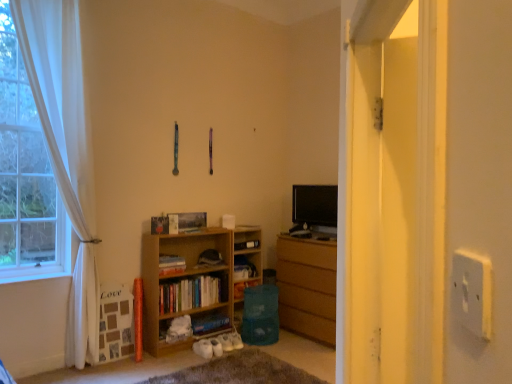
The image size is (512, 384). What do you see at coordinates (244, 287) in the screenshot? I see `wooden bookshelf at center` at bounding box center [244, 287].

Identify the location of wooden bookshelf at center. (244, 287).

Locate an element on the screen. This screenshot has height=384, width=512. light brown wood bookcase at lower left is located at coordinates (192, 281).

Describe the element at coordinates (307, 287) in the screenshot. I see `wooden chest of drawers at center` at that location.

Measure the distance between hardcover book at center, which appears as the first book when viewed from the top, and camera.

The depth of hardcover book at center, which appears as the first book when viewed from the top, is 3.81 meters.

At what (x,y) coordinates should I click in order to perform the action: click on hardcover book at center, which appears as the first book when viewed from the top. Please return your answer as a coordinate pair (x, y). Image resolution: width=512 pixels, height=384 pixels. Looking at the image, I should click on (170, 264).

Locate an element on the screen. wooden bookshelf at center, which is the 2th book from top to bottom is located at coordinates (190, 294).

Considering the sizes of objects hardcover book at center, which appears as the first book when viewed from the top, and light brown wood bookcase at lower left in the image provided, who is taller, hardcover book at center, which appears as the first book when viewed from the top, or light brown wood bookcase at lower left?

With more height is light brown wood bookcase at lower left.

Is hardcover book at center, which appears as the first book when viewed from the top, positioned before light brown wood bookcase at lower left?

No, hardcover book at center, which appears as the first book when viewed from the top, is behind light brown wood bookcase at lower left.

From a real-world perspective, who is located lower, hardcover book at center, which appears as the first book when viewed from the top, or light brown wood bookcase at lower left?

light brown wood bookcase at lower left, from a real-world perspective.

Considering the positions of point (184, 259) and point (156, 338), is point (184, 259) closer or farther from the camera than point (156, 338)?

Point (184, 259).

Are white sheer curtain at left and hardcover book at lower center, positioned as the 3th book in top-to-bottom order, beside each other?

No, white sheer curtain at left is not with hardcover book at lower center, positioned as the 3th book in top-to-bottom order.

Which object is positioned more to the right, white sheer curtain at left or hardcover book at lower center, positioned as the 3th book in top-to-bottom order?

hardcover book at lower center, positioned as the 3th book in top-to-bottom order, is more to the right.

From a real-world perspective, is white sheer curtain at left physically above hardcover book at lower center, arranged as the first book when ordered from the bottom?

Correct, in the physical world, white sheer curtain at left is higher than hardcover book at lower center, arranged as the first book when ordered from the bottom.

In the scene shown: Does white sheer curtain at left come behind hardcover book at lower center, positioned as the 3th book in top-to-bottom order?

No, white sheer curtain at left is in front of hardcover book at lower center, positioned as the 3th book in top-to-bottom order.

Is light brown wood bookcase at lower left in contact with wooden chest of drawers at center?

No, light brown wood bookcase at lower left is not touching wooden chest of drawers at center.

Between point (173, 247) and point (328, 246), which one is positioned behind?

The point (173, 247) is more distant.

Can you tell me how much light brown wood bookcase at lower left and wooden chest of drawers at center differ in facing direction?

There is a 91.6-degree angle between the facing directions of light brown wood bookcase at lower left and wooden chest of drawers at center.

Does wooden chest of drawers at center contain wooden bookshelf at center, placed as the 2th book when sorted from bottom to top?

No.

From a real-world perspective, which object rests below the other?

wooden chest of drawers at center is physically lower.

From the image's perspective, is wooden chest of drawers at center beneath wooden bookshelf at center, placed as the 2th book when sorted from bottom to top?

Indeed, from the image's perspective, wooden chest of drawers at center is shown beneath wooden bookshelf at center, placed as the 2th book when sorted from bottom to top.

From a real-world perspective, count 1st books upward from the wooden chest of drawers at center and point to it. Please provide its 2D coordinates.

[(190, 294)]

Which object is thinner, wooden chest of drawers at center or hardcover book at center, which is counted as the third book, starting from the bottom?

With smaller width is hardcover book at center, which is counted as the third book, starting from the bottom.

Is wooden chest of drawers at center to the left or to the right of hardcover book at center, which is counted as the third book, starting from the bottom, in the image?

wooden chest of drawers at center is positioned on hardcover book at center, which is counted as the third book, starting from the bottom,'s right side.

Would you say wooden chest of drawers at center is a long distance from hardcover book at center, which is counted as the third book, starting from the bottom?

Yes, wooden chest of drawers at center and hardcover book at center, which is counted as the third book, starting from the bottom, are located far from each other.

Is wooden chest of drawers at center aimed at hardcover book at center, which is counted as the third book, starting from the bottom?

Answer: Yes, wooden chest of drawers at center faces towards hardcover book at center, which is counted as the third book, starting from the bottom.

Which point is more distant from viewer, [490,314] or [200,319]?

Positioned behind is point [200,319].

Is white plastic electric outlet at right not near hardcover book at lower center, positioned as the 3th book in top-to-bottom order?

Yes, white plastic electric outlet at right and hardcover book at lower center, positioned as the 3th book in top-to-bottom order, are quite far apart.

What's the angular difference between white plastic electric outlet at right and hardcover book at lower center, positioned as the 3th book in top-to-bottom order,'s facing directions?

The facing directions of white plastic electric outlet at right and hardcover book at lower center, positioned as the 3th book in top-to-bottom order, are 133 degrees apart.

Between black glossy tv at center and light brown wood bookcase at lower left, which one is positioned behind?

black glossy tv at center.

Could you tell me if black glossy tv at center is turned towards light brown wood bookcase at lower left?

No.

Would you consider black glossy tv at center to be distant from light brown wood bookcase at lower left?

Yes, black glossy tv at center and light brown wood bookcase at lower left are quite far apart.

Is point (319, 194) farther from camera compared to point (205, 232)?

Yes.

Where is `book positioned vertically above the light brown wood bookcase at lower left (from a real-world perspective)`? The width and height of the screenshot is (512, 384). book positioned vertically above the light brown wood bookcase at lower left (from a real-world perspective) is located at coordinates (170, 264).

Image resolution: width=512 pixels, height=384 pixels. I want to click on curtain above the hardcover book at lower center, positioned as the 3th book in top-to-bottom order (from the image's perspective), so click(x=64, y=147).

Based on their spatial positions, is hardcover book at center, which appears as the first book when viewed from the top, or wooden chest of drawers at center further from white plastic electric outlet at right?

wooden chest of drawers at center.

From the image, which object appears to be nearer to wooden bookshelf at center, placed as the 2th book when sorted from bottom to top, black glossy tv at center or white sheer curtain at left?

white sheer curtain at left lies closer to wooden bookshelf at center, placed as the 2th book when sorted from bottom to top, than the other object.

Which object lies nearer to the anchor point light brown wood bookcase at lower left, wooden chest of drawers at center or hardcover book at center, which is counted as the third book, starting from the bottom?

The object closer to light brown wood bookcase at lower left is hardcover book at center, which is counted as the third book, starting from the bottom.

Based on the photo, from the image, which object appears to be farther from transparent plastic screen door at right, wooden chest of drawers at center or white sheer curtain at left?

Among the two, white sheer curtain at left is located further to transparent plastic screen door at right.

Looking at the image, which one is located closer to wooden chest of drawers at center, wooden bookshelf at center or wooden bookshelf at center, which is the 2th book from top to bottom?

wooden bookshelf at center is positioned closer to the anchor wooden chest of drawers at center.

Considering their positions, is wooden chest of drawers at center positioned further to white sheer curtain at left than hardcover book at lower center, positioned as the 3th book in top-to-bottom order?

wooden chest of drawers at center is further to white sheer curtain at left.

When comparing their distances from white sheer curtain at left, does black glossy tv at center or wooden chest of drawers at center seem further?

black glossy tv at center is positioned further to the anchor white sheer curtain at left.

Estimate the real-world distances between objects in this image. Which object is further from black glossy tv at center, transparent plastic screen door at right or white plastic electric outlet at right?

Based on the image, white plastic electric outlet at right appears to be further to black glossy tv at center.

Locate an element on the screen. curtain between transparent plastic screen door at right and wooden bookshelf at center, placed as the 2th book when sorted from bottom to top, in the front-back direction is located at coordinates (64, 147).

This screenshot has height=384, width=512. Find the location of `the chest of drawers positioned between white plastic electric outlet at right and black glossy tv at center from near to far`. the chest of drawers positioned between white plastic electric outlet at right and black glossy tv at center from near to far is located at coordinates (307, 287).

Where is `bookcase between hardcover book at center, which is counted as the third book, starting from the bottom, and wooden bookshelf at center`? The width and height of the screenshot is (512, 384). bookcase between hardcover book at center, which is counted as the third book, starting from the bottom, and wooden bookshelf at center is located at coordinates (192, 281).

Identify the location of curtain located between transparent plastic screen door at right and light brown wood bookcase at lower left in the depth direction. (64, 147).